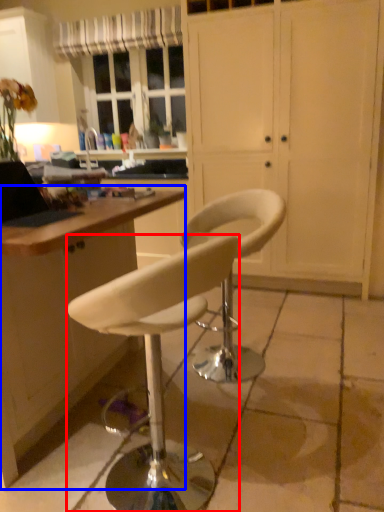
Question: Which object appears closest to the camera in this image, chair (highlighted by a red box) or desk (highlighted by a blue box)?

Choices:
 (A) chair
 (B) desk

Answer: (A)